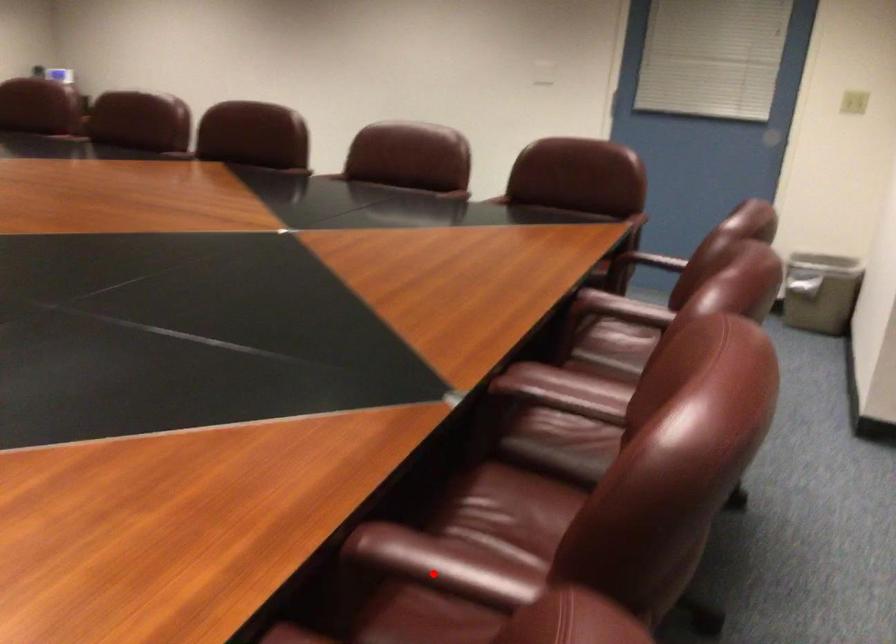
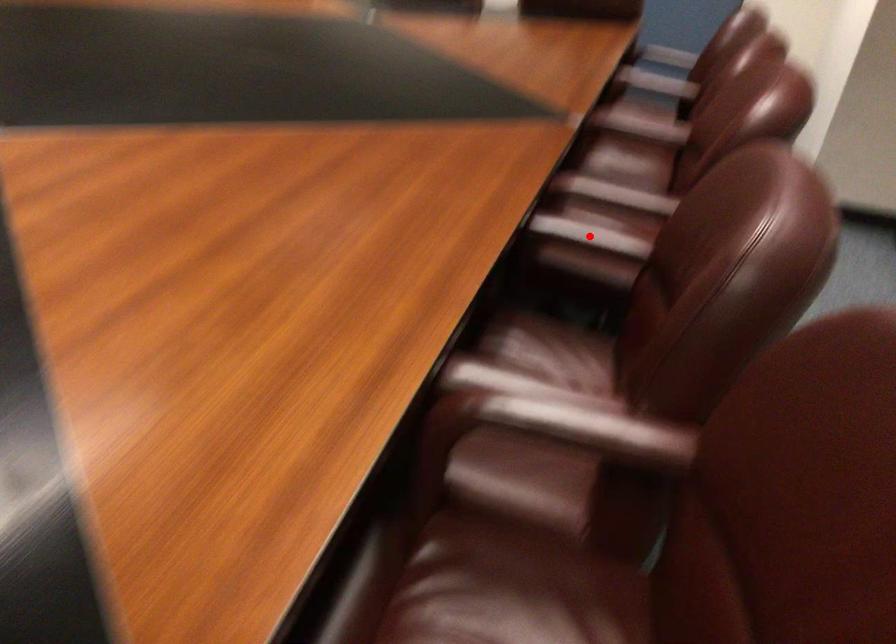
I am providing you with two images of the same scene from different viewpoints. A red point is marked on the first image and another point is marked on the second image. Do the highlighted points in image1 and image2 indicate the same real-world spot?

No